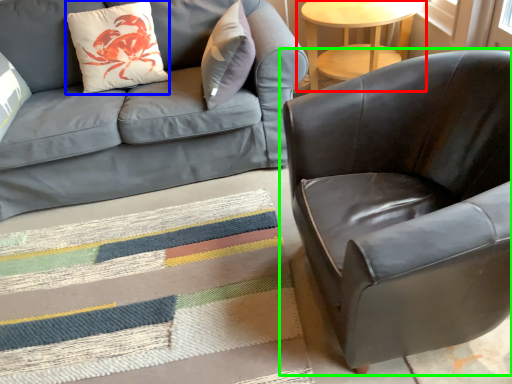
Question: Estimate the real-world distances between objects in this image. Which object is farther from table (highlighted by a red box), throw pillow (highlighted by a blue box) or chair (highlighted by a green box)?

Choices:
 (A) throw pillow
 (B) chair

Answer: (B)